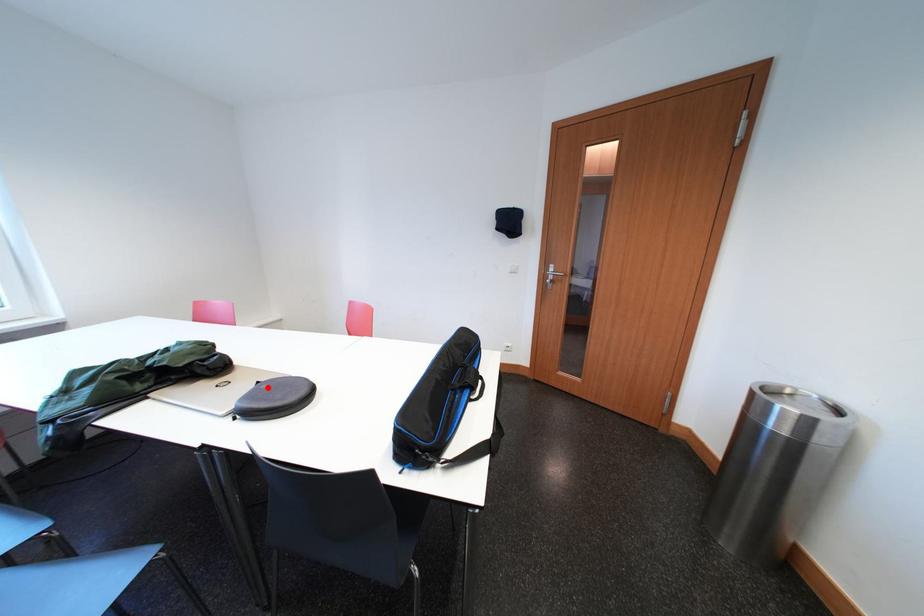
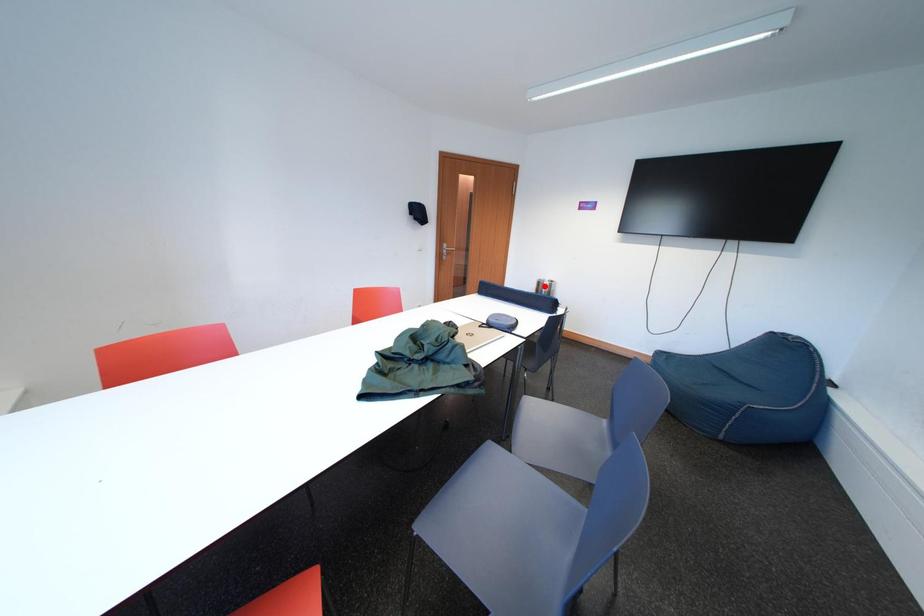
I am providing you with two images of the same scene from different viewpoints. A red point is marked on the first image and another point is marked on the second image. Do the highlighted points in image1 and image2 indicate the same real-world spot?

No